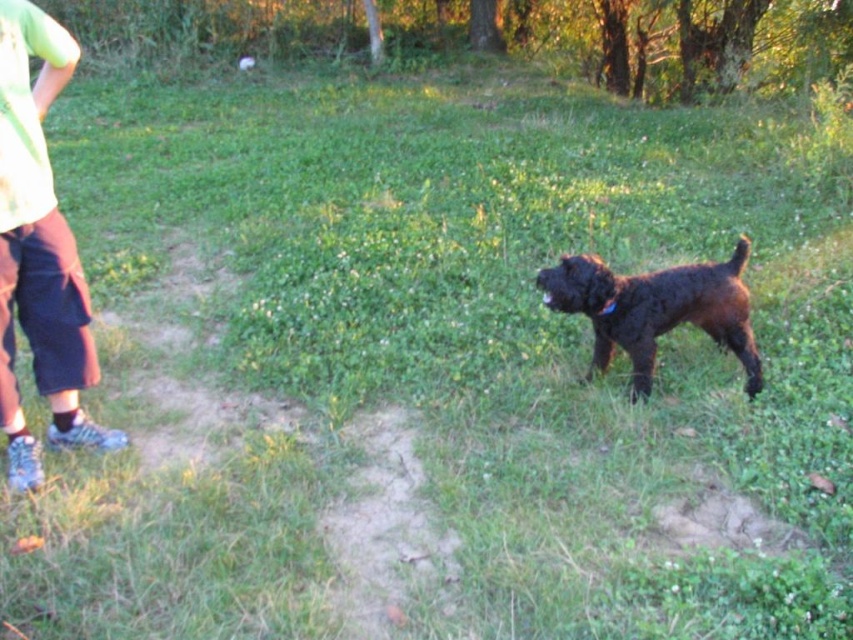
Question: Is light green t-shirt at left wider than wet brown fur dog at center?

Choices:
 (A) no
 (B) yes

Answer: (A)

Question: Which of the following is the farthest from the observer?

Choices:
 (A) wet brown fur dog at center
 (B) light green t-shirt at left

Answer: (A)

Question: Does light green t-shirt at left have a greater width compared to wet brown fur dog at center?

Choices:
 (A) yes
 (B) no

Answer: (B)

Question: Is light green t-shirt at left positioned at the back of wet brown fur dog at center?

Choices:
 (A) yes
 (B) no

Answer: (B)